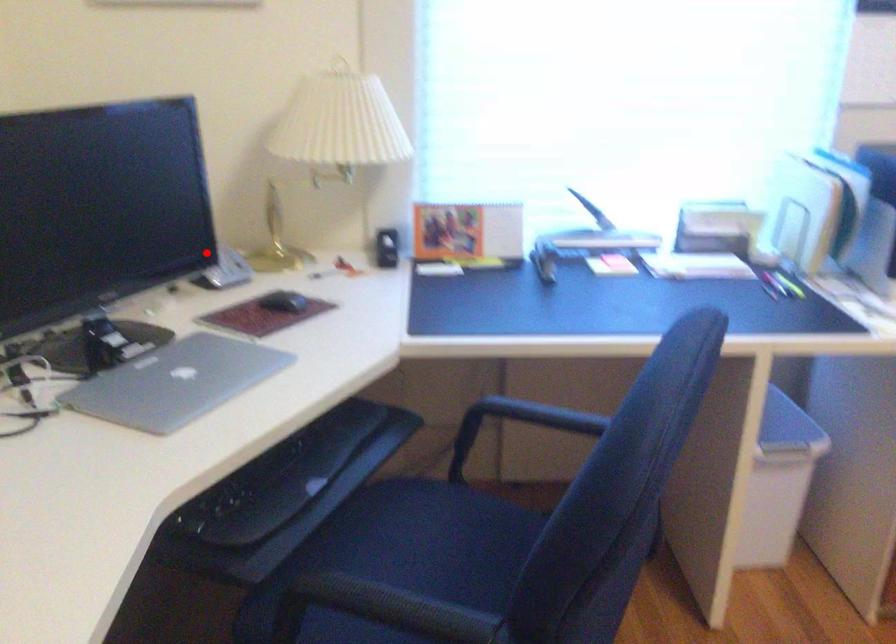
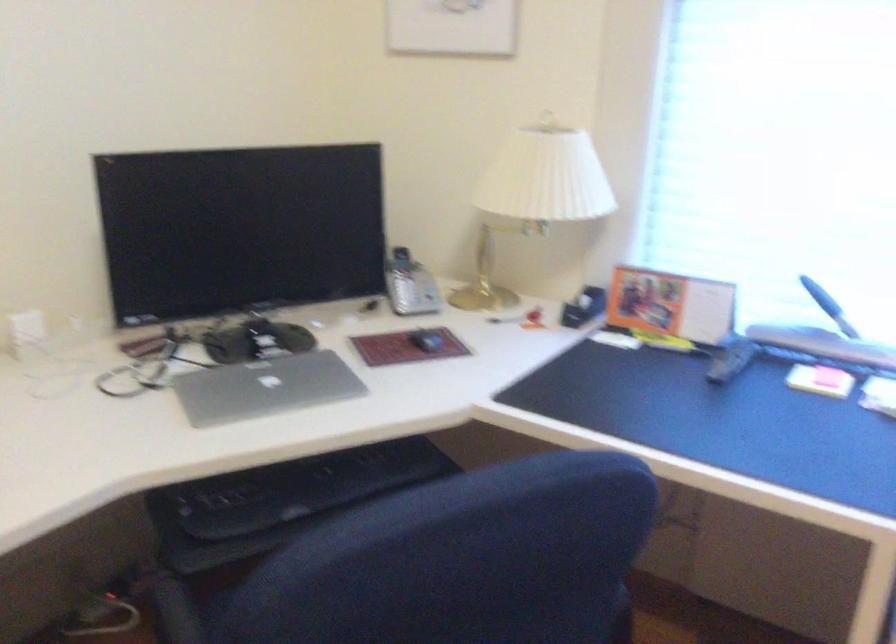
The point at the highlighted location is marked in the first image. Where is the corresponding point in the second image?

(401, 281)